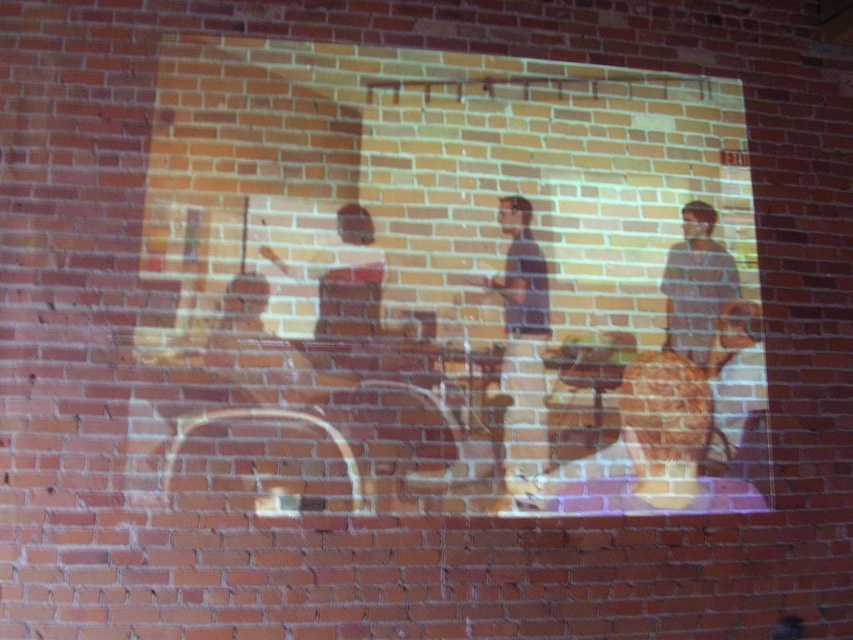
Question: Is matte brown guitar at center above striped shirt at right?

Choices:
 (A) yes
 (B) no

Answer: (B)

Question: Which of the following is the closest to the observer?

Choices:
 (A) striped shirt at right
 (B) matte brown guitar at right

Answer: (B)

Question: Is dark blue shirt at center bigger than matte brown guitar at right?

Choices:
 (A) yes
 (B) no

Answer: (A)

Question: Which point is farther to the camera?

Choices:
 (A) matte brown guitar at right
 (B) dark blue shirt at center
 (C) striped shirt at right
 (D) matte brown guitar at center

Answer: (C)

Question: Is matte brown guitar at center to the left of striped shirt at right from the viewer's perspective?

Choices:
 (A) yes
 (B) no

Answer: (A)

Question: Which of the following is the farthest from the observer?

Choices:
 (A) striped shirt at right
 (B) dark blue shirt at center
 (C) matte brown guitar at right
 (D) matte brown guitar at center

Answer: (A)